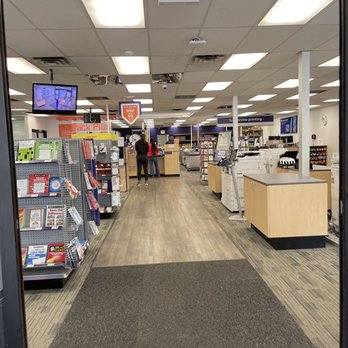
Image resolution: width=348 pixels, height=348 pixels. I want to click on gray rectangular rug, so click(193, 315).